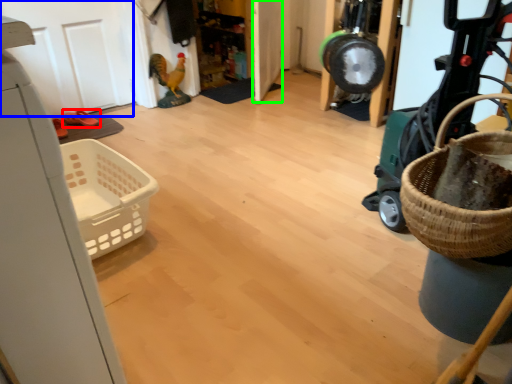
Question: Which object is the closest to the footwear (highlighted by a red box)? Choose among these: door (highlighted by a blue box) or door (highlighted by a green box).

Choices:
 (A) door
 (B) door

Answer: (A)